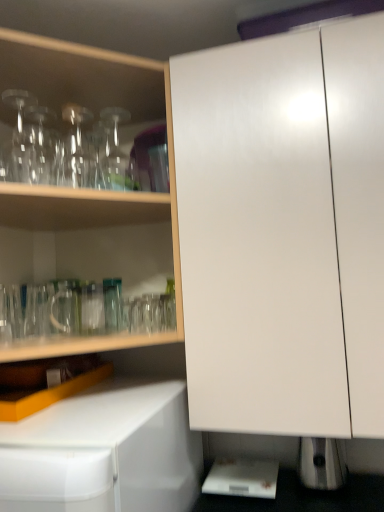
I want to click on white glossy cabinet at center, which appears as the 1th cabinetry when viewed from the right, so click(284, 231).

The width and height of the screenshot is (384, 512). What do you see at coordinates (78, 149) in the screenshot? I see `transparent glass bottle at upper left, acting as the second bottle starting from the right` at bounding box center [78, 149].

Where is `transparent glass bottle at upper left, acting as the second bottle starting from the left`? Image resolution: width=384 pixels, height=512 pixels. transparent glass bottle at upper left, acting as the second bottle starting from the left is located at coordinates (115, 152).

Is white glossy cabinet at center, marked as the second cabinetry in a left-to-right arrangement, positioned in front of transparent glassware at upper left, arranged as the first cabinetry when viewed from the left?

That is True.

Who is shorter, white glossy cabinet at center, which appears as the 1th cabinetry when viewed from the right, or transparent glassware at upper left, arranged as the first cabinetry when viewed from the left?

transparent glassware at upper left, arranged as the first cabinetry when viewed from the left, is shorter.

Is white glossy cabinet at center, which appears as the 1th cabinetry when viewed from the right, far from transparent glassware at upper left, marked as the 2th cabinetry in a right-to-left arrangement?

white glossy cabinet at center, which appears as the 1th cabinetry when viewed from the right, is actually quite close to transparent glassware at upper left, marked as the 2th cabinetry in a right-to-left arrangement.

From a real-world perspective, between white glossy cabinet at center, which appears as the 1th cabinetry when viewed from the right, and transparent glassware at upper left, marked as the 2th cabinetry in a right-to-left arrangement, who is vertically lower?

From a 3D spatial view, white glossy cabinet at center, which appears as the 1th cabinetry when viewed from the right, is below.

Between transparent glass bottle at upper left, which is the 1th bottle in right-to-left order, and transparent glassware at upper left, marked as the 2th cabinetry in a right-to-left arrangement, which one has larger width?

transparent glassware at upper left, marked as the 2th cabinetry in a right-to-left arrangement.

From the image's perspective, which is below, transparent glass bottle at upper left, acting as the second bottle starting from the left, or transparent glassware at upper left, arranged as the first cabinetry when viewed from the left?

transparent glassware at upper left, arranged as the first cabinetry when viewed from the left.

From the picture: Is transparent glass bottle at upper left, which is the 1th bottle in right-to-left order, far away from transparent glassware at upper left, arranged as the first cabinetry when viewed from the left?

transparent glass bottle at upper left, which is the 1th bottle in right-to-left order, is actually quite close to transparent glassware at upper left, arranged as the first cabinetry when viewed from the left.

From the transparent glass bottle at upper left, acting as the second bottle starting from the left, count 1st cabinetrys forward and point to it. Please provide its 2D coordinates.

[(90, 189)]

Between transparent glassware at upper left, arranged as the first cabinetry when viewed from the left, and transparent glass bottle at upper left, the first bottle when ordered from left to right, which one appears on the left side from the viewer's perspective?

Positioned to the left is transparent glass bottle at upper left, the first bottle when ordered from left to right.

In terms of width, does transparent glassware at upper left, arranged as the first cabinetry when viewed from the left, look wider or thinner when compared to transparent glass bottle at upper left, acting as the second bottle starting from the right?

In the image, transparent glassware at upper left, arranged as the first cabinetry when viewed from the left, appears to be wider than transparent glass bottle at upper left, acting as the second bottle starting from the right.

Considering the sizes of transparent glassware at upper left, arranged as the first cabinetry when viewed from the left, and transparent glass bottle at upper left, the first bottle when ordered from left to right, in the image, is transparent glassware at upper left, arranged as the first cabinetry when viewed from the left, taller or shorter than transparent glass bottle at upper left, the first bottle when ordered from left to right,?

transparent glassware at upper left, arranged as the first cabinetry when viewed from the left, is taller than transparent glass bottle at upper left, the first bottle when ordered from left to right.

Would you say transparent glassware at upper left, marked as the 2th cabinetry in a right-to-left arrangement, is a long distance from transparent glass bottle at upper left, acting as the second bottle starting from the right?

No, transparent glassware at upper left, marked as the 2th cabinetry in a right-to-left arrangement, is not far away from transparent glass bottle at upper left, acting as the second bottle starting from the right.

I want to click on the 1st cabinetry below the transparent glass bottle at upper left, which is the 1th bottle in right-to-left order (from a real-world perspective), so click(x=90, y=189).

Considering the relative positions of transparent glassware at upper left, marked as the 2th cabinetry in a right-to-left arrangement, and transparent glass bottle at upper left, which is the 1th bottle in right-to-left order, in the image provided, is transparent glassware at upper left, marked as the 2th cabinetry in a right-to-left arrangement, to the left or to the right of transparent glass bottle at upper left, which is the 1th bottle in right-to-left order,?

From the image, it's evident that transparent glassware at upper left, marked as the 2th cabinetry in a right-to-left arrangement, is to the left of transparent glass bottle at upper left, which is the 1th bottle in right-to-left order.

Consider the image. Could you measure the distance between transparent glassware at upper left, arranged as the first cabinetry when viewed from the left, and transparent glass bottle at upper left, which is the 1th bottle in right-to-left order?

transparent glassware at upper left, arranged as the first cabinetry when viewed from the left, and transparent glass bottle at upper left, which is the 1th bottle in right-to-left order, are 23.81 centimeters apart from each other.

Could you tell me if transparent glassware at upper left, arranged as the first cabinetry when viewed from the left, is facing transparent glass bottle at upper left, acting as the second bottle starting from the left?

Yes, transparent glassware at upper left, arranged as the first cabinetry when viewed from the left, faces towards transparent glass bottle at upper left, acting as the second bottle starting from the left.

Is transparent glass bottle at upper left, the first bottle when ordered from left to right, not near transparent glass bottle at upper left, which is the 1th bottle in right-to-left order?

No, transparent glass bottle at upper left, the first bottle when ordered from left to right, is not far from transparent glass bottle at upper left, which is the 1th bottle in right-to-left order.

Does transparent glass bottle at upper left, acting as the second bottle starting from the right, have a greater height compared to transparent glass bottle at upper left, which is the 1th bottle in right-to-left order?

Yes, transparent glass bottle at upper left, acting as the second bottle starting from the right, is taller than transparent glass bottle at upper left, which is the 1th bottle in right-to-left order.

Measure the distance from transparent glass bottle at upper left, the first bottle when ordered from left to right, to transparent glass bottle at upper left, which is the 1th bottle in right-to-left order.

transparent glass bottle at upper left, the first bottle when ordered from left to right, and transparent glass bottle at upper left, which is the 1th bottle in right-to-left order, are 3.81 inches apart.

How different are the orientations of transparent glass bottle at upper left, the first bottle when ordered from left to right, and transparent glass bottle at upper left, which is the 1th bottle in right-to-left order, in degrees?

0.000957 degrees separate the facing orientations of transparent glass bottle at upper left, the first bottle when ordered from left to right, and transparent glass bottle at upper left, which is the 1th bottle in right-to-left order.

Based on the photo, between transparent glass bottle at upper left, the first bottle when ordered from left to right, and transparent glassware at upper left, marked as the 2th cabinetry in a right-to-left arrangement, which one is positioned in front?

Positioned in front is transparent glassware at upper left, marked as the 2th cabinetry in a right-to-left arrangement.

Is transparent glass bottle at upper left, the first bottle when ordered from left to right, oriented towards transparent glassware at upper left, arranged as the first cabinetry when viewed from the left?

Yes, transparent glass bottle at upper left, the first bottle when ordered from left to right, faces towards transparent glassware at upper left, arranged as the first cabinetry when viewed from the left.

Would you say transparent glass bottle at upper left, the first bottle when ordered from left to right, is outside transparent glassware at upper left, arranged as the first cabinetry when viewed from the left?

Result: No, most part of transparent glass bottle at upper left, the first bottle when ordered from left to right, lies within transparent glassware at upper left, arranged as the first cabinetry when viewed from the left.

Which object is positioned more to the right, transparent glass bottle at upper left, the first bottle when ordered from left to right, or transparent glassware at upper left, marked as the 2th cabinetry in a right-to-left arrangement?

From the viewer's perspective, transparent glassware at upper left, marked as the 2th cabinetry in a right-to-left arrangement, appears more on the right side.

Is transparent glassware at upper left, arranged as the first cabinetry when viewed from the left, in front of or behind white glossy cabinet at center, marked as the second cabinetry in a left-to-right arrangement, in the image?

In the image, transparent glassware at upper left, arranged as the first cabinetry when viewed from the left, appears behind white glossy cabinet at center, marked as the second cabinetry in a left-to-right arrangement.

From a real-world perspective, is transparent glassware at upper left, arranged as the first cabinetry when viewed from the left, physically above white glossy cabinet at center, which appears as the 1th cabinetry when viewed from the right?

Correct, in the physical world, transparent glassware at upper left, arranged as the first cabinetry when viewed from the left, is higher than white glossy cabinet at center, which appears as the 1th cabinetry when viewed from the right.

Would you say transparent glassware at upper left, arranged as the first cabinetry when viewed from the left, is outside white glossy cabinet at center, which appears as the 1th cabinetry when viewed from the right?

Indeed, transparent glassware at upper left, arranged as the first cabinetry when viewed from the left, is completely outside white glossy cabinet at center, which appears as the 1th cabinetry when viewed from the right.

Is transparent glassware at upper left, marked as the 2th cabinetry in a right-to-left arrangement, placed right next to white glossy cabinet at center, which appears as the 1th cabinetry when viewed from the right?

No, transparent glassware at upper left, marked as the 2th cabinetry in a right-to-left arrangement, is not next to white glossy cabinet at center, which appears as the 1th cabinetry when viewed from the right.

Where is `cabinetry above the white glossy cabinet at center, marked as the second cabinetry in a left-to-right arrangement (from a real-world perspective)`? cabinetry above the white glossy cabinet at center, marked as the second cabinetry in a left-to-right arrangement (from a real-world perspective) is located at coordinates (90, 189).

Where is `cabinetry that is the 1st one below the transparent glass bottle at upper left, which is the 1th bottle in right-to-left order (from a real-world perspective)`? cabinetry that is the 1st one below the transparent glass bottle at upper left, which is the 1th bottle in right-to-left order (from a real-world perspective) is located at coordinates (90, 189).

Looking at the image, which one is located further to transparent glassware at upper left, arranged as the first cabinetry when viewed from the left, white glossy cabinet at center, marked as the second cabinetry in a left-to-right arrangement, or transparent glass bottle at upper left, the first bottle when ordered from left to right?

The object further to transparent glassware at upper left, arranged as the first cabinetry when viewed from the left, is white glossy cabinet at center, marked as the second cabinetry in a left-to-right arrangement.

When comparing their distances from transparent glassware at upper left, marked as the 2th cabinetry in a right-to-left arrangement, does transparent glass bottle at upper left, acting as the second bottle starting from the left, or white glossy cabinet at center, marked as the second cabinetry in a left-to-right arrangement, seem closer?

Based on the image, transparent glass bottle at upper left, acting as the second bottle starting from the left, appears to be nearer to transparent glassware at upper left, marked as the 2th cabinetry in a right-to-left arrangement.

From the image, which object appears to be farther from transparent glass bottle at upper left, which is the 1th bottle in right-to-left order, white glossy cabinet at center, marked as the second cabinetry in a left-to-right arrangement, or transparent glass bottle at upper left, the first bottle when ordered from left to right?

Based on the image, white glossy cabinet at center, marked as the second cabinetry in a left-to-right arrangement, appears to be further to transparent glass bottle at upper left, which is the 1th bottle in right-to-left order.

Estimate the real-world distances between objects in this image. Which object is closer to transparent glass bottle at upper left, which is the 1th bottle in right-to-left order, transparent glass bottle at upper left, the first bottle when ordered from left to right, or transparent glassware at upper left, marked as the 2th cabinetry in a right-to-left arrangement?

transparent glass bottle at upper left, the first bottle when ordered from left to right, lies closer to transparent glass bottle at upper left, which is the 1th bottle in right-to-left order, than the other object.

Based on their spatial positions, is transparent glass bottle at upper left, acting as the second bottle starting from the right, or transparent glass bottle at upper left, which is the 1th bottle in right-to-left order, closer to white glossy cabinet at center, which appears as the 1th cabinetry when viewed from the right?

Based on the image, transparent glass bottle at upper left, acting as the second bottle starting from the right, appears to be nearer to white glossy cabinet at center, which appears as the 1th cabinetry when viewed from the right.

Which object lies nearer to the anchor point transparent glass bottle at upper left, acting as the second bottle starting from the left, transparent glassware at upper left, arranged as the first cabinetry when viewed from the left, or transparent glass bottle at upper left, the first bottle when ordered from left to right?

transparent glass bottle at upper left, the first bottle when ordered from left to right, lies closer to transparent glass bottle at upper left, acting as the second bottle starting from the left, than the other object.

Looking at the image, which one is located further to white glossy cabinet at center, which appears as the 1th cabinetry when viewed from the right, transparent glass bottle at upper left, acting as the second bottle starting from the left, or transparent glassware at upper left, marked as the 2th cabinetry in a right-to-left arrangement?

transparent glass bottle at upper left, acting as the second bottle starting from the left, is further to white glossy cabinet at center, which appears as the 1th cabinetry when viewed from the right.

Estimate the real-world distances between objects in this image. Which object is further from transparent glass bottle at upper left, the first bottle when ordered from left to right, transparent glassware at upper left, arranged as the first cabinetry when viewed from the left, or transparent glass bottle at upper left, acting as the second bottle starting from the left?

The object further to transparent glass bottle at upper left, the first bottle when ordered from left to right, is transparent glassware at upper left, arranged as the first cabinetry when viewed from the left.

Find the location of a particular element. This screenshot has width=384, height=512. bottle between transparent glass bottle at upper left, the first bottle when ordered from left to right, and white glossy cabinet at center, which appears as the 1th cabinetry when viewed from the right, in the horizontal direction is located at coordinates (115, 152).

The width and height of the screenshot is (384, 512). In order to click on bottle situated between transparent glassware at upper left, arranged as the first cabinetry when viewed from the left, and white glossy cabinet at center, marked as the second cabinetry in a left-to-right arrangement, from left to right in this screenshot , I will do `click(115, 152)`.

Identify the location of cabinetry located between transparent glass bottle at upper left, the first bottle when ordered from left to right, and white glossy cabinet at center, marked as the second cabinetry in a left-to-right arrangement, in the left-right direction. Image resolution: width=384 pixels, height=512 pixels. (90, 189).

Identify the location of bottle located between transparent glassware at upper left, marked as the 2th cabinetry in a right-to-left arrangement, and transparent glass bottle at upper left, the first bottle when ordered from left to right, in the depth direction. The image size is (384, 512). (115, 152).